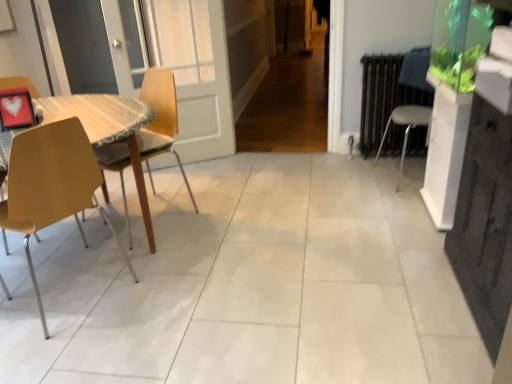
Locate an element on the screen. The height and width of the screenshot is (384, 512). vacant space in front of matte yellow chair at left, placed as the 1th chair when sorted from left to right is located at coordinates (61, 342).